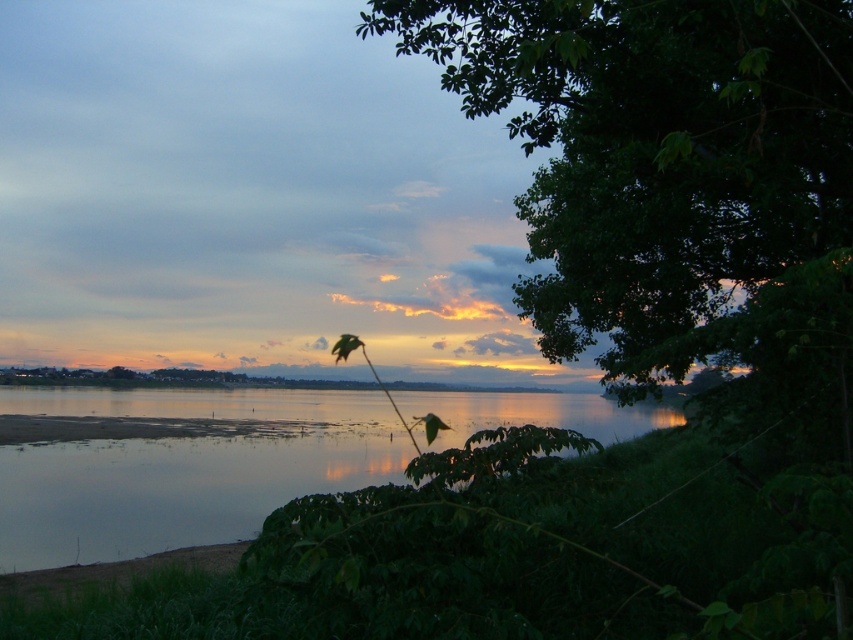
Between green leafy tree at upper right and silvery reflective water at center, which one has less height?

silvery reflective water at center is shorter.

Does point (677, 49) come closer to viewer compared to point (56, 410)?

Yes, it is.

Where is `green leafy tree at upper right`? Image resolution: width=853 pixels, height=640 pixels. green leafy tree at upper right is located at coordinates (654, 150).

The width and height of the screenshot is (853, 640). In order to click on green leafy tree at upper right in this screenshot , I will do `click(654, 150)`.